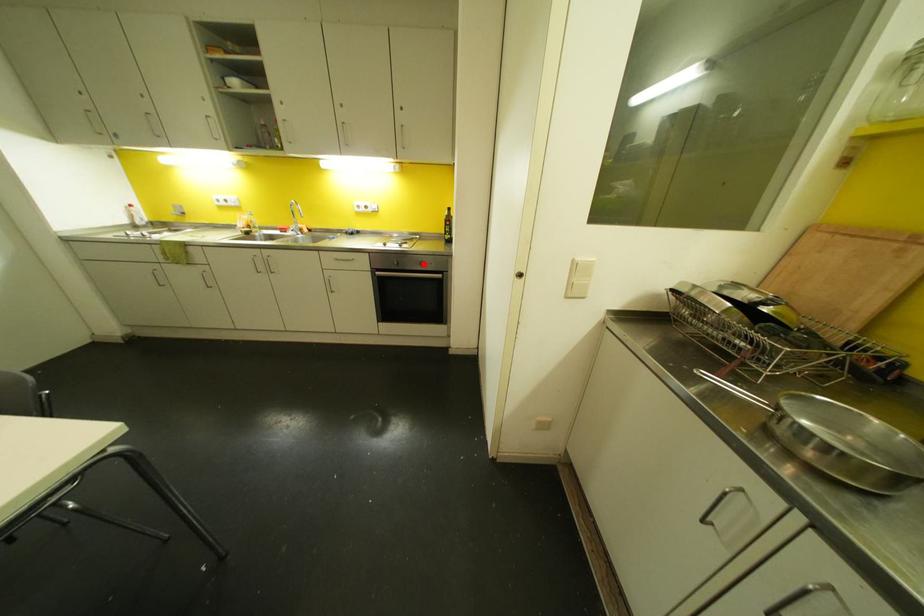
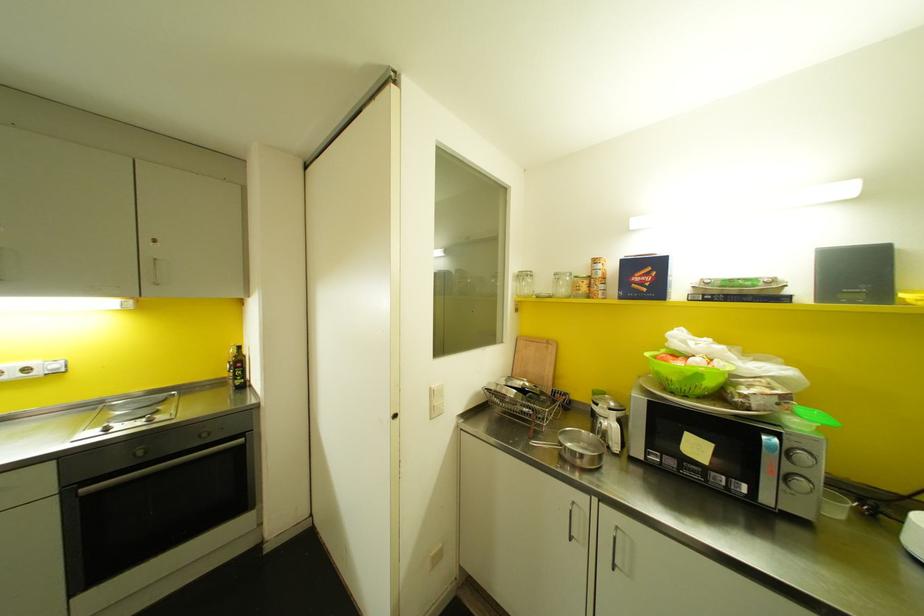
Locate, in the second image, the point that corresponds to the highlighted location in the first image.

(204, 434)